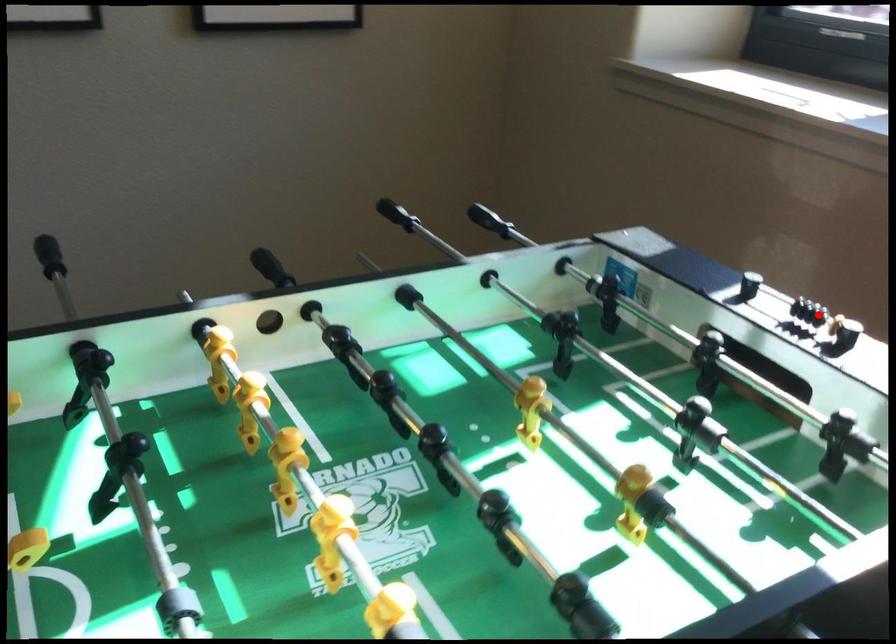
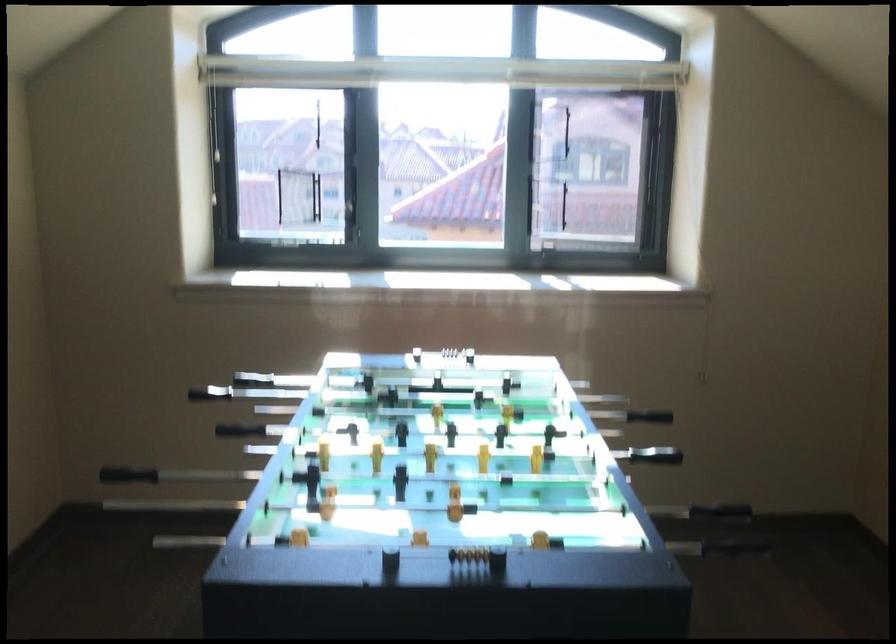
Find the pixel in the second image that matches the highlighted location in the first image.

(442, 353)